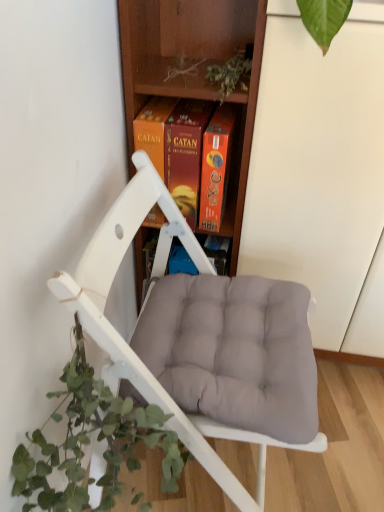
Question: Is white matte chair at center to the right of orange cardboard game box at center from the viewer's perspective?

Choices:
 (A) no
 (B) yes

Answer: (B)

Question: From a real-world perspective, is white matte chair at center positioned under orange cardboard game box at center based on gravity?

Choices:
 (A) yes
 (B) no

Answer: (A)

Question: Is white matte chair at center not within orange cardboard game box at center?

Choices:
 (A) no
 (B) yes

Answer: (B)

Question: Could you tell me if white matte chair at center is turned towards orange cardboard game box at center?

Choices:
 (A) no
 (B) yes

Answer: (A)

Question: From the image's perspective, is white matte chair at center on orange cardboard game box at center?

Choices:
 (A) no
 (B) yes

Answer: (A)

Question: Is orange cardboard game box at center at the back of white matte chair at center?

Choices:
 (A) no
 (B) yes

Answer: (A)

Question: Can you confirm if wooden at center is shorter than orange cardboard game box at center?

Choices:
 (A) no
 (B) yes

Answer: (A)

Question: From the image's perspective, is wooden at center beneath orange cardboard game box at center?

Choices:
 (A) yes
 (B) no

Answer: (B)

Question: Is the depth of wooden at center greater than that of orange cardboard game box at center?

Choices:
 (A) no
 (B) yes

Answer: (A)

Question: From a real-world perspective, is wooden at center positioned over orange cardboard game box at center based on gravity?

Choices:
 (A) no
 (B) yes

Answer: (A)

Question: Could you tell me if wooden at center is turned towards orange cardboard game box at center?

Choices:
 (A) no
 (B) yes

Answer: (B)

Question: Is wooden at center closer to the viewer compared to orange cardboard game box at center?

Choices:
 (A) yes
 (B) no

Answer: (A)

Question: Is white matte chair at center at the right side of green leafy plant at lower left?

Choices:
 (A) no
 (B) yes

Answer: (B)